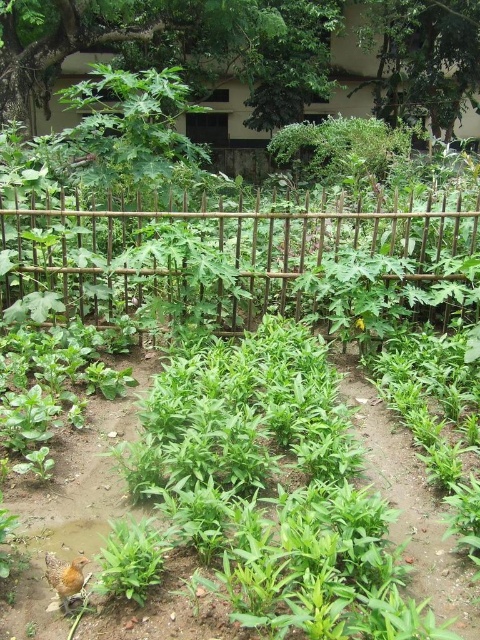
Does brown metal fence at center appear on the left side of green leafy plants at center?

Yes, brown metal fence at center is to the left of green leafy plants at center.

Which of these two, brown metal fence at center or green leafy plants at center, stands taller?

Standing taller between the two is brown metal fence at center.

Is point (219, 312) farther from camera compared to point (457, 621)?

Yes, point (219, 312) is farther from viewer.

I want to click on brown metal fence at center, so click(x=220, y=246).